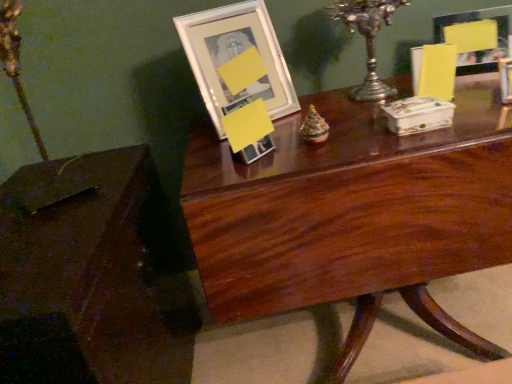
Identify the location of vacant area situated below mahogany wood table at center, which is the second table in left-to-right order (from a real-world perspective). Image resolution: width=512 pixels, height=384 pixels. (391, 334).